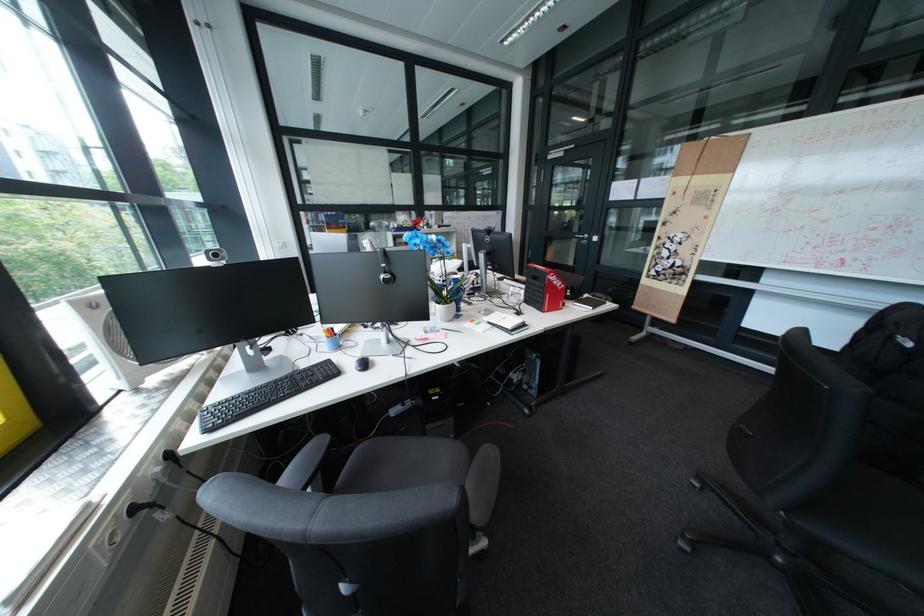
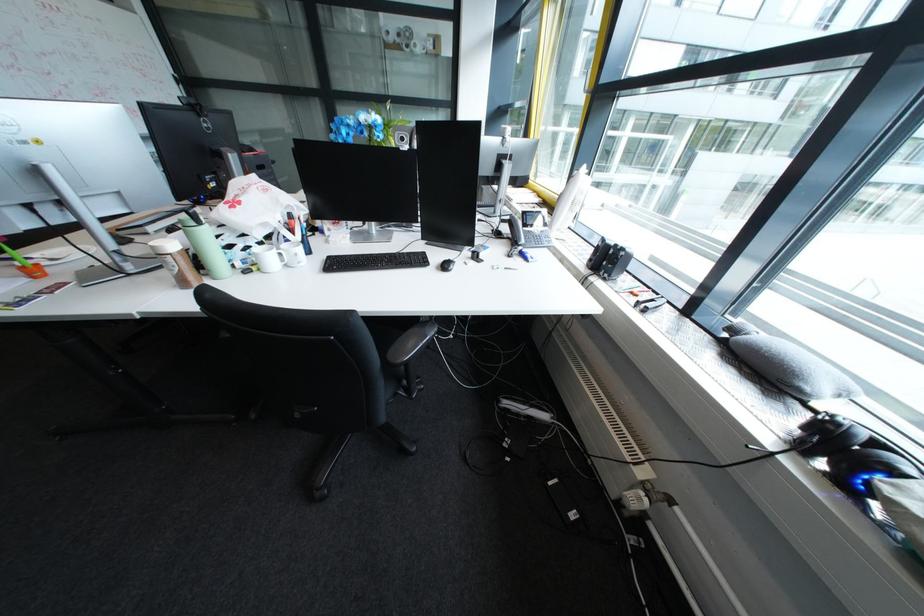
Question: I am providing you with two images of the same scene from different viewpoints. Please identify which objects are invisible in image2.

Choices:
 (A) light green bottle
 (B) black computer mouse
 (C) brown shaker bottle
 (D) padded stool surface

Answer: (B)